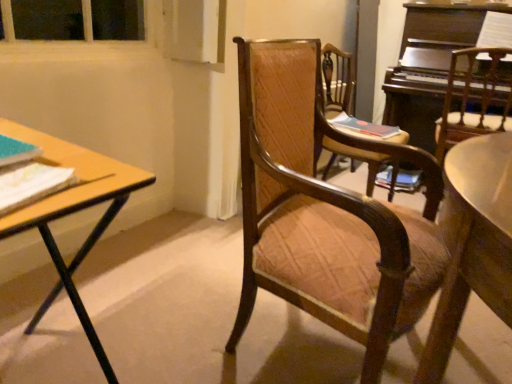
Question: Considering their positions, is wooden textured chair at center, which is counted as the second chair, starting from the left, located in front of or behind matte blue book at left, which is the 2th book in bottom-to-top order?

Choices:
 (A) front
 (B) behind

Answer: (B)

Question: Considering the positions of point (372, 180) and point (0, 134), is point (372, 180) closer or farther from the camera than point (0, 134)?

Choices:
 (A) farther
 (B) closer

Answer: (A)

Question: Estimate the real-world distances between objects in this image. Which object is closer to the wooden chair at center, acting as the first chair starting from the right?

Choices:
 (A) dark wood piano at upper right
 (B) white paper at left, which is the 3th book from back to front
 (C) wooden desk at left
 (D) matte blue book at left, which ranks as the 2th book in back-to-front order
 (E) wooden chair at center, marked as the 1th chair in a left-to-right arrangement

Answer: (A)

Question: Which of these objects is positioned farthest from the matte pink book at center, arranged as the 3th book when viewed from the left?

Choices:
 (A) wooden desk at left
 (B) dark wood piano at upper right
 (C) white paper at left, which is the first book from bottom to top
 (D) wooden chair at center, acting as the 3th chair starting from the left
 (E) wooden chair at center, marked as the 1th chair in a left-to-right arrangement

Answer: (C)